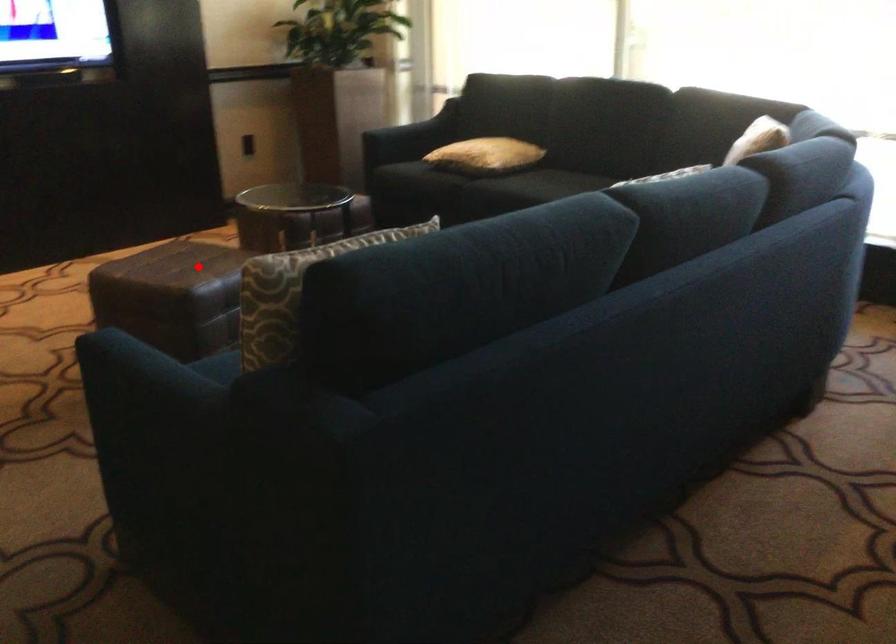
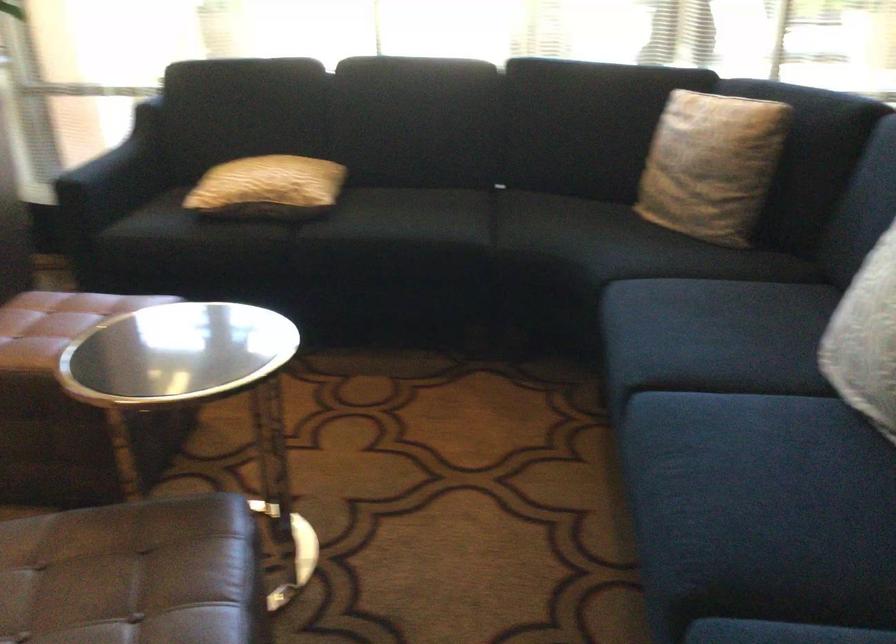
The point at the highlighted location is marked in the first image. Where is the corresponding point in the second image?

(134, 574)